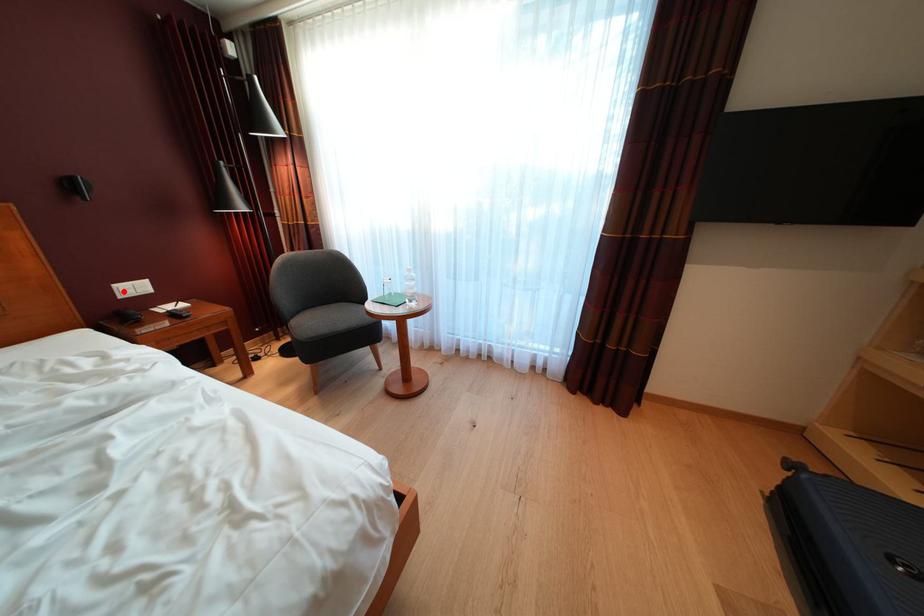
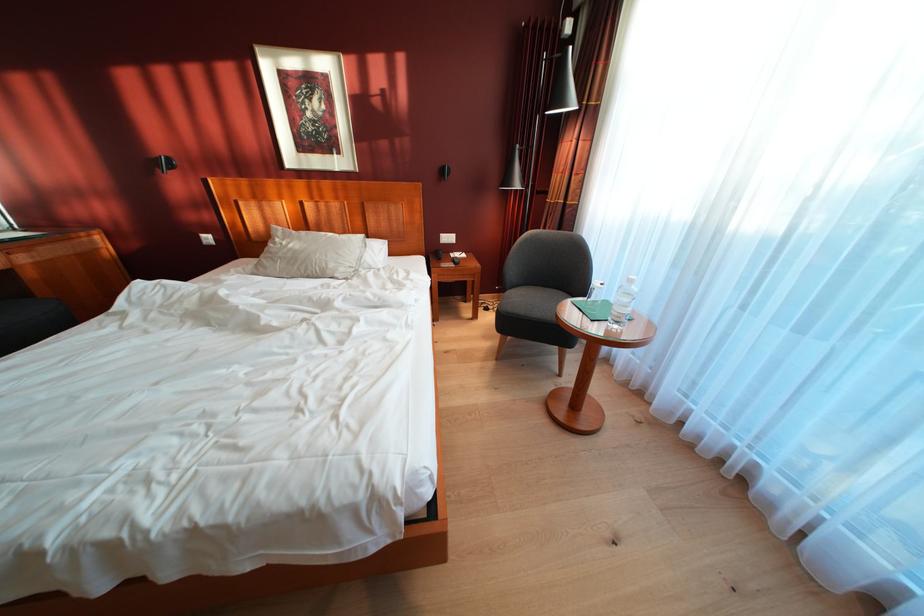
Question: I am providing you with two images of the same scene from different viewpoints. A red point is shown in image1. For the corresponding object point in image2, is it positioned nearer or farther from the camera?

Choices:
 (A) Nearer
 (B) Farther

Answer: (A)